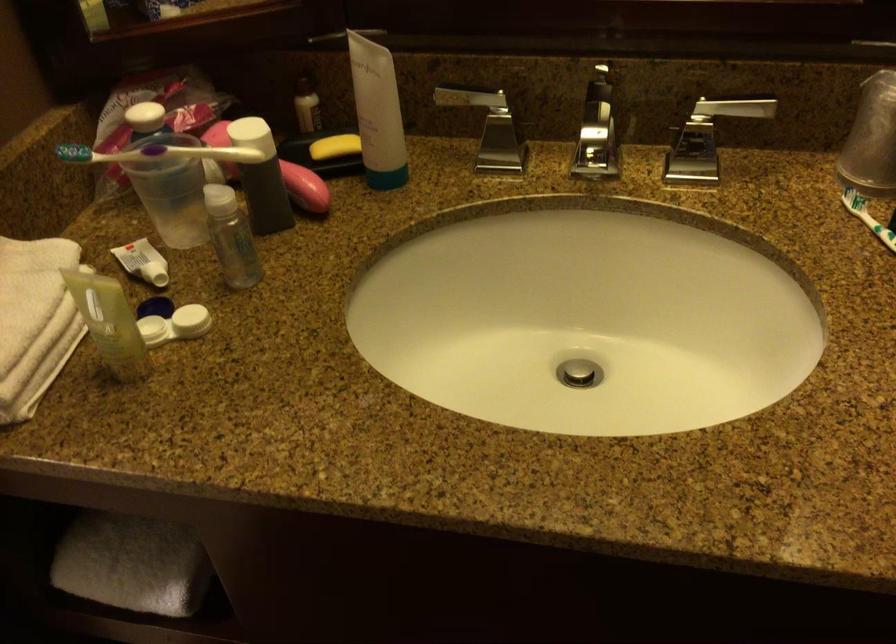
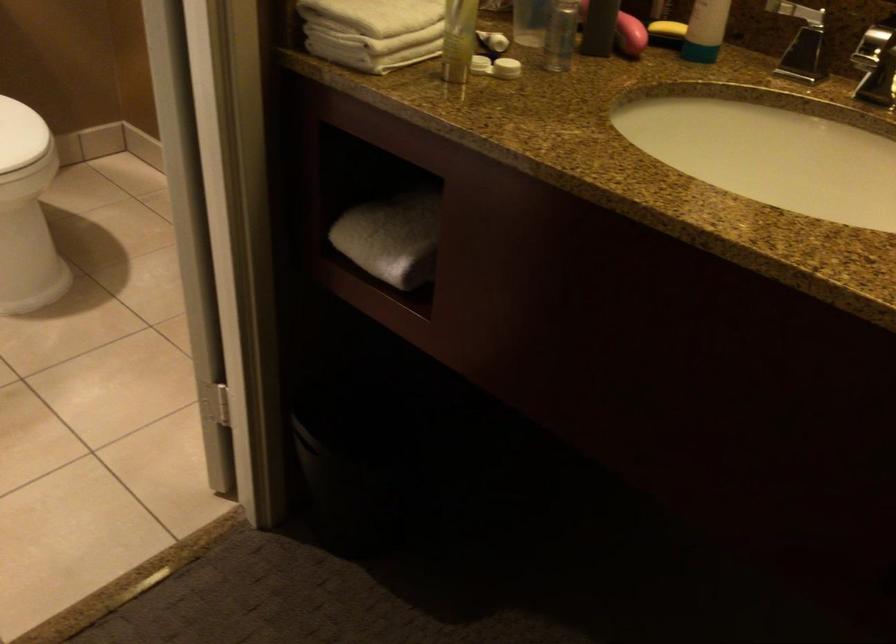
Find the pixel in the second image that matches (x=152, y=330) in the first image.

(479, 64)